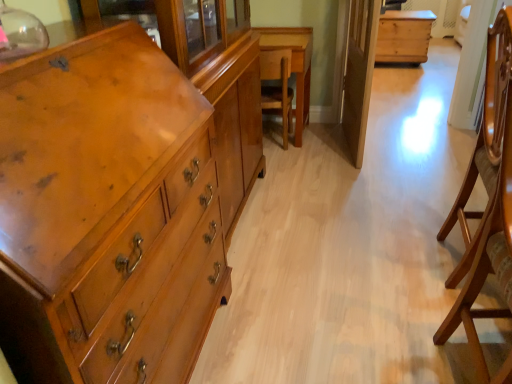
Question: Based on their positions, is natural wood chest at center, which is counted as the 1th table, starting from the top, located to the left or right of wooden table at center, which is counted as the 2th table, starting from the top?

Choices:
 (A) right
 (B) left

Answer: (A)

Question: From their relative heights in the image, would you say natural wood chest at center, the second table positioned from the bottom, is taller or shorter than wooden table at center, arranged as the 1th table when viewed from the left?

Choices:
 (A) tall
 (B) short

Answer: (B)

Question: Considering the real-world distances, which object is closest to the transparent glass door at center?

Choices:
 (A) wooden chair at center, which appears as the 2th armchair when ordered from the bottom
 (B) wooden armchair at right, the 1th armchair ordered from the bottom
 (C) matte wood chest of drawers at left
 (D) wooden table at center, arranged as the 1th table when viewed from the left
 (E) natural wood chest at center, the second table positioned from the bottom

Answer: (D)

Question: Which object is positioned closest to the natural wood chest at center, which is the 1th table from right to left?

Choices:
 (A) transparent glass door at center
 (B) matte wood chest of drawers at left
 (C) wooden armchair at right, marked as the 2th armchair in a top-to-bottom arrangement
 (D) wooden table at center, which is the 2th table from right to left
 (E) wooden chair at center, marked as the second armchair in a right-to-left arrangement

Answer: (D)